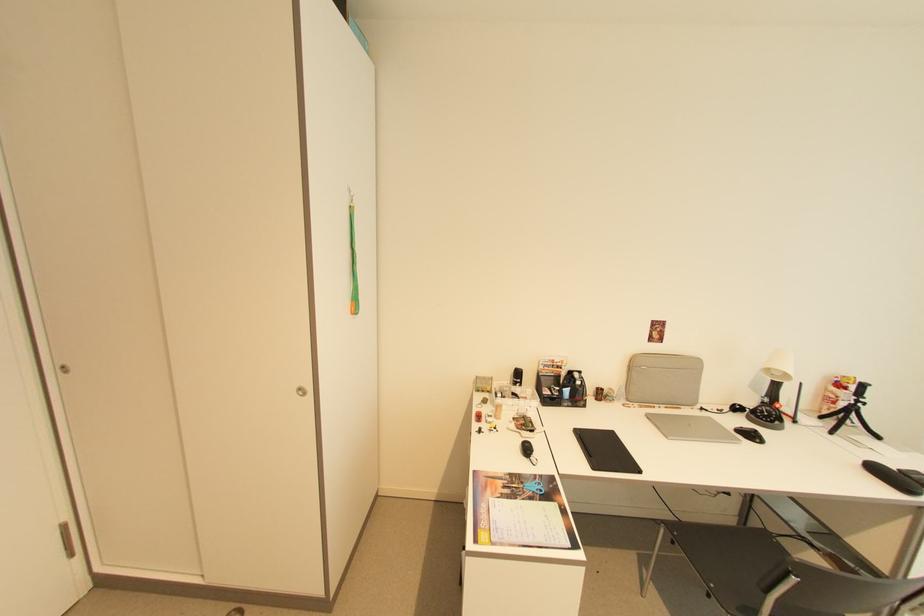
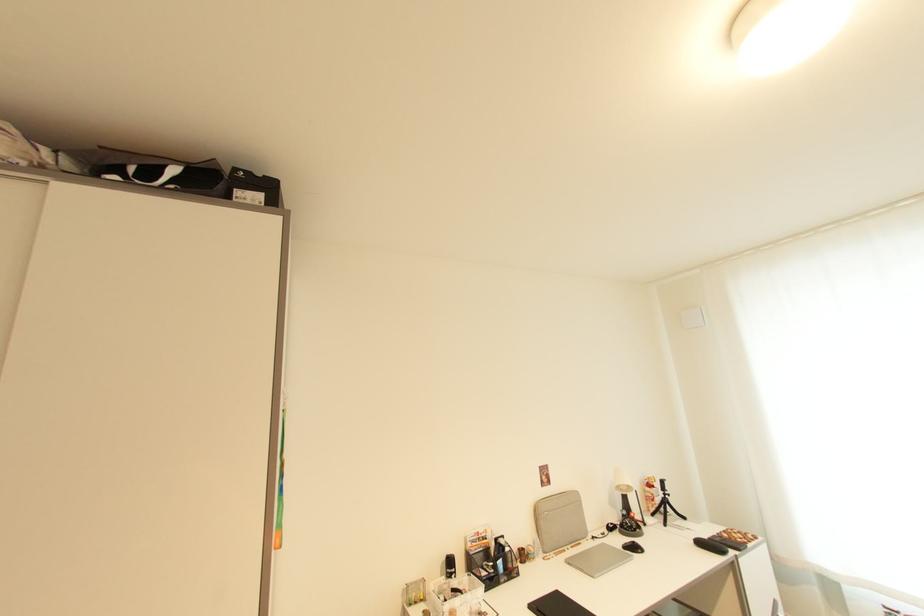
Locate, in the second image, the point that corresponds to [518,371] in the first image.

(450, 561)